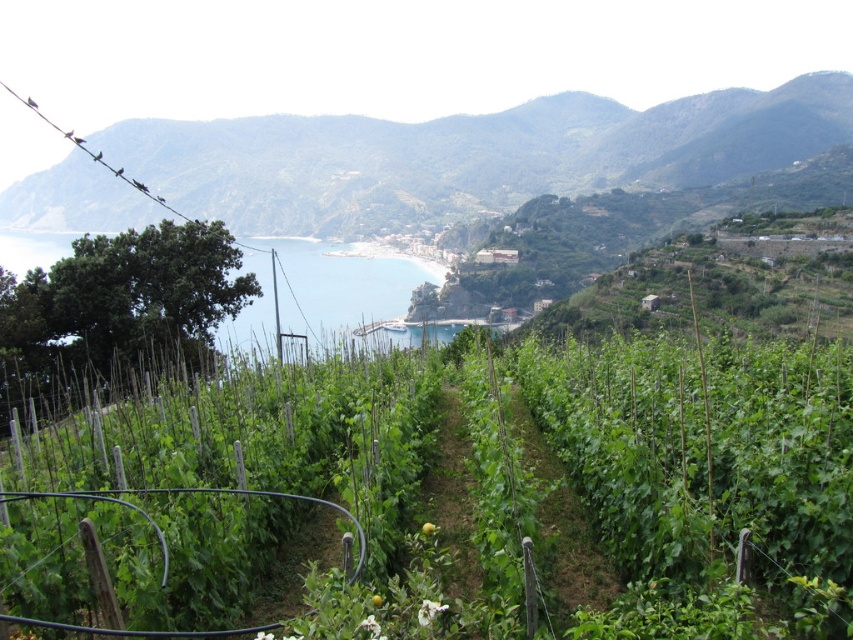
Question: Which is nearer to the green leafy hillside at upper center?

Choices:
 (A) blue water at center
 (B) green leafy vines at center

Answer: (A)

Question: Is green leafy hillside at upper center further to camera compared to blue water at center?

Choices:
 (A) yes
 (B) no

Answer: (A)

Question: Does green leafy vines at center appear on the right side of blue water at center?

Choices:
 (A) no
 (B) yes

Answer: (B)

Question: Which is farther from the green leafy vines at center?

Choices:
 (A) blue water at center
 (B) green leafy hillside at upper center

Answer: (B)

Question: Among these objects, which one is farthest from the camera?

Choices:
 (A) green leafy vines at center
 (B) blue water at center

Answer: (B)

Question: Is green leafy vines at center to the left of green leafy hillside at upper center from the viewer's perspective?

Choices:
 (A) yes
 (B) no

Answer: (B)